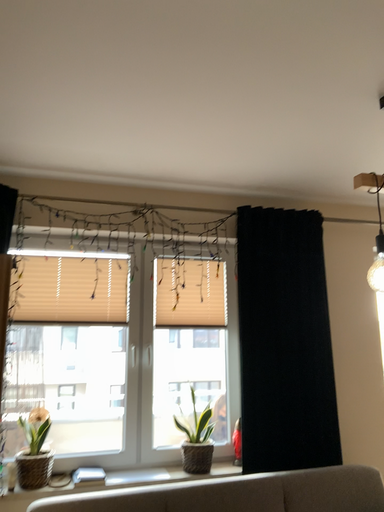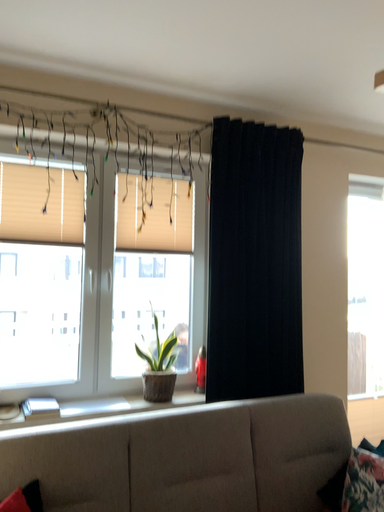
Question: Which way did the camera rotate in the video?

Choices:
 (A) rotated upward
 (B) rotated downward

Answer: (B)